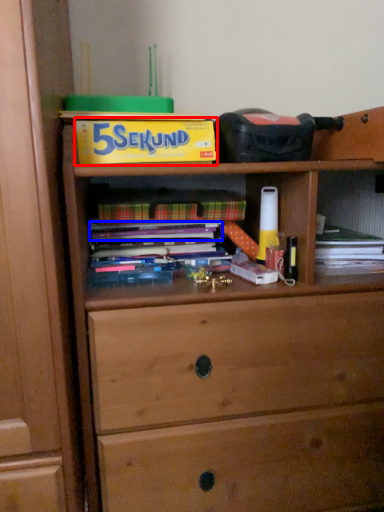
Question: Among these objects, which one is nearest to the camera, paperback book (highlighted by a red box) or book (highlighted by a blue box)?

Choices:
 (A) paperback book
 (B) book

Answer: (A)